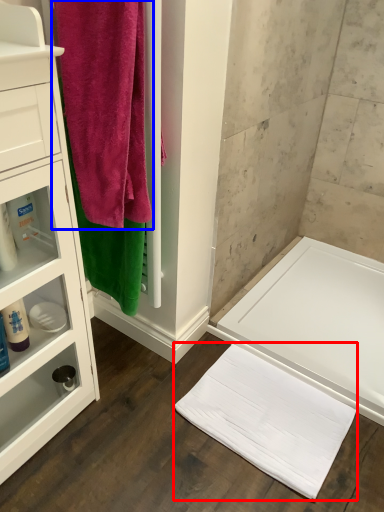
Question: Which object appears closest to the camera in this image, bath towel (highlighted by a red box) or towel (highlighted by a blue box)?

Choices:
 (A) bath towel
 (B) towel

Answer: (B)